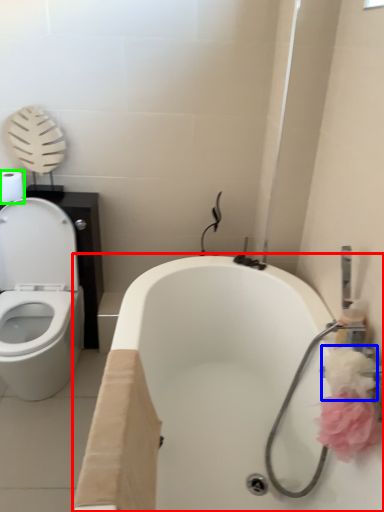
Question: Which is farther away from bath (highlighted by a red box)? flower (highlighted by a blue box) or toilet paper (highlighted by a green box)?

Choices:
 (A) flower
 (B) toilet paper

Answer: (B)